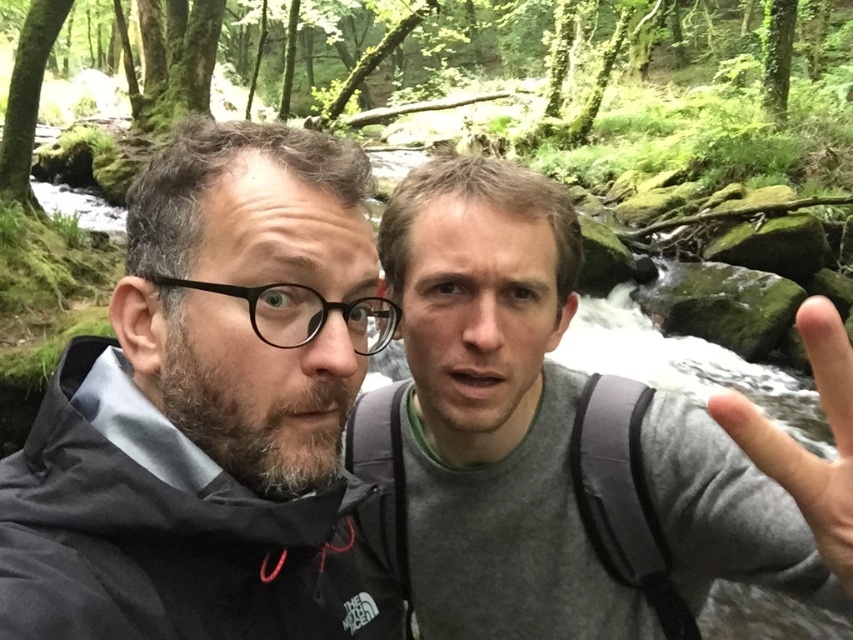
You are a hiker planning to cross a stream in the forest. You see the dark gray jacket at left and the skinny flesh at center in your path. Which object should you avoid stepping on to ensure safety?

You should avoid stepping on the skinny flesh at center because the dark gray jacket at left is taller and likely represents a stable surface, while the skinny flesh at center is lower and might be slippery or unstable.